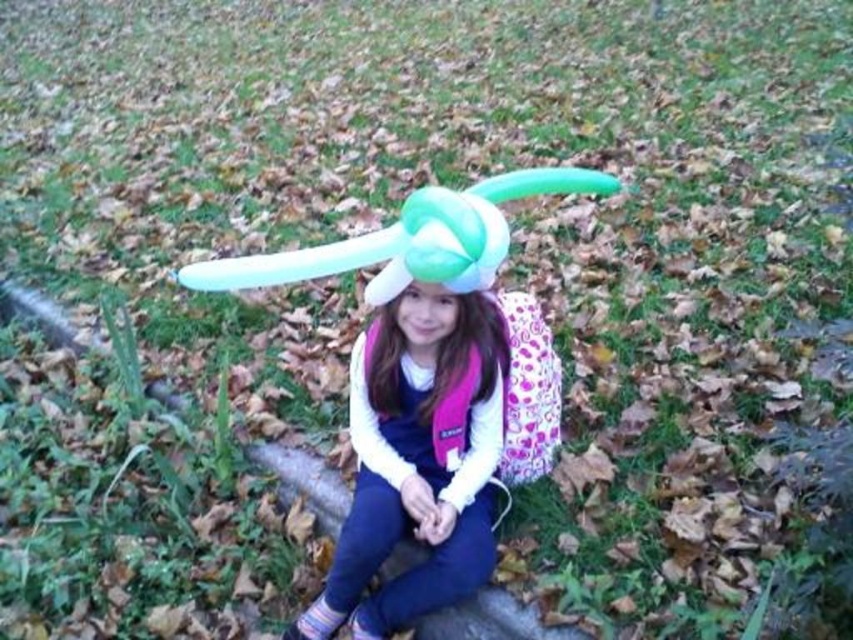
What do you see at coordinates (416, 461) in the screenshot?
I see `matte white balloon at center` at bounding box center [416, 461].

Is point (397, 344) positioned before point (386, 332)?

Yes, it is in front of point (386, 332).

The image size is (853, 640). Find the location of `matte white balloon at center`. matte white balloon at center is located at coordinates (416, 461).